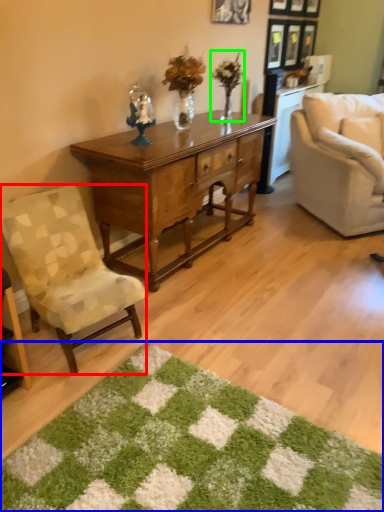
Question: Which object is the farthest from chair (highlighted by a red box)? Choose among these: mat (highlighted by a blue box) or houseplant (highlighted by a green box).

Choices:
 (A) mat
 (B) houseplant

Answer: (B)